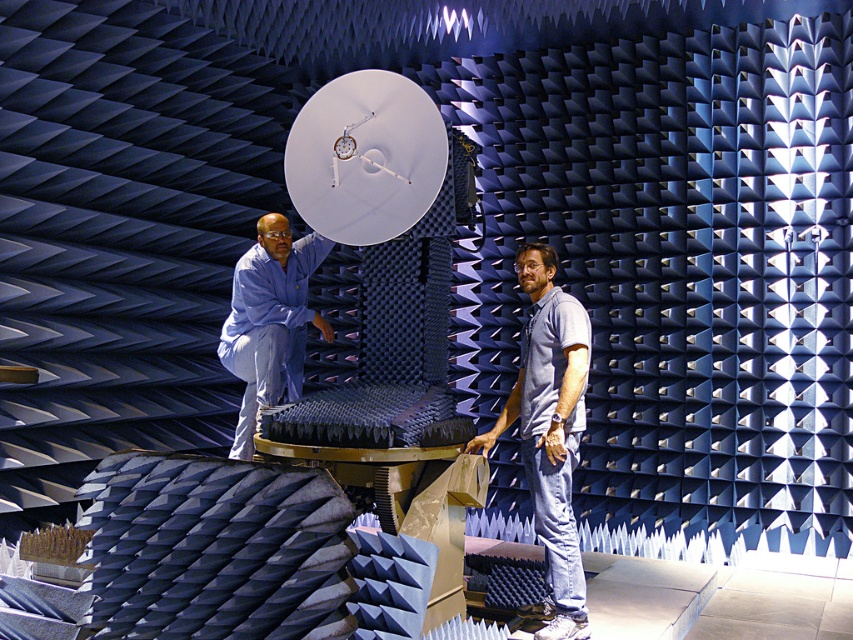
You are an engineer in the anechoic chamber. You need to place a 1.5 meter wide equipment box between the white matte satellite at center and the blue fabric shirt at upper left. Is there enough space?

The white matte satellite at center is wider than the blue fabric shirt at upper left, but the exact distance between them isn

You are standing in an anechoic chamber and need to reach the white matte satellite at center to adjust its alignment. The chamber has a strict rule that you must stay at least 12 feet away from all equipment to prevent interference. Can you safely approach the satellite without violating the rule?

The white matte satellite at center is 11.57 feet away from the camera, which is less than the required 12 feet distance. Therefore, approaching it would violate the chamber rules.

You are standing at point (381,138) in an anechoic chamber. The chamber has a height of 4 meters. Is the ceiling above you higher than 3.70 meters?

The distance between point (381,138) and the camera is 3.70 meters. Since the camera is at your eye level, the ceiling height at that point is 4 meters, which is higher than 3.70 meters. Therefore, the ceiling above you is higher than 3.70 meters.